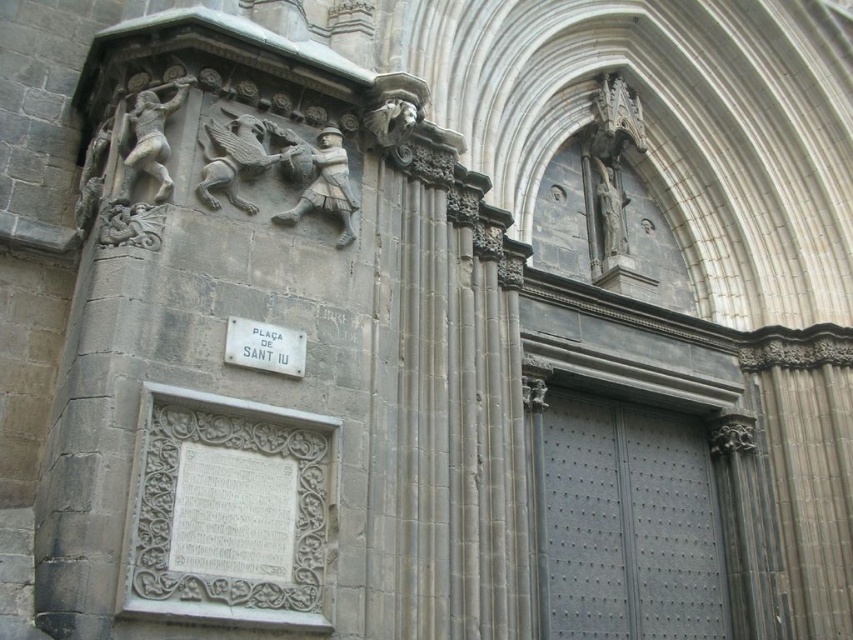
You are an architect planning to install a new door in a building. The door you have is exactly the same size as the white metal plaque at lower left. Can you use this door to replace the gray metallic door at center without any modifications?

The gray metallic door at center is larger in width than the white metal plaque at lower left, so the new door you have, which matches the plaque size, would be too small to replace the existing door without adjustments.